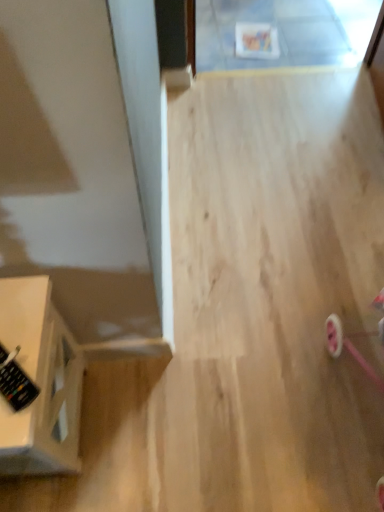
Locate an element on the screen. free point to the right of white glossy side table at left is located at coordinates (139, 420).